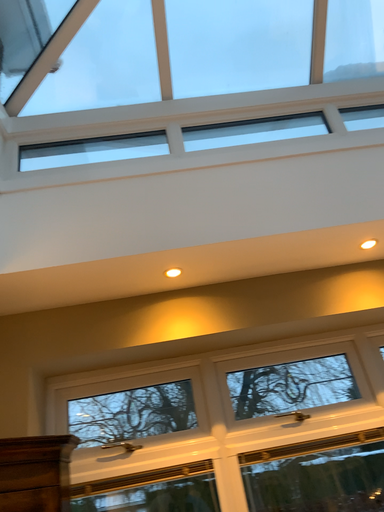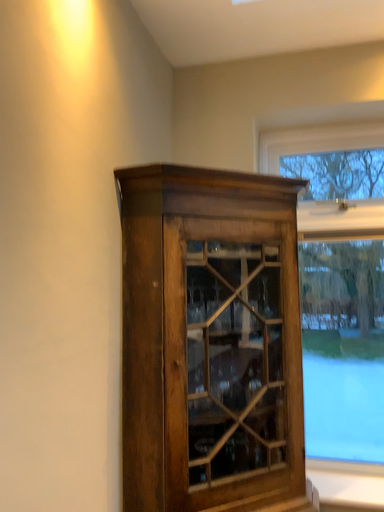
Question: How did the camera likely rotate when shooting the video?

Choices:
 (A) rotated left
 (B) rotated right

Answer: (A)